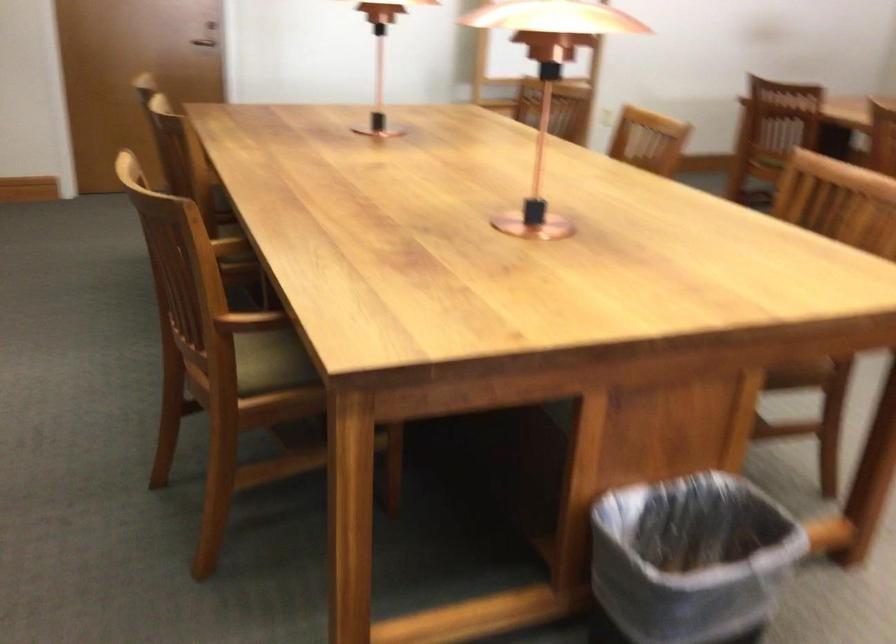
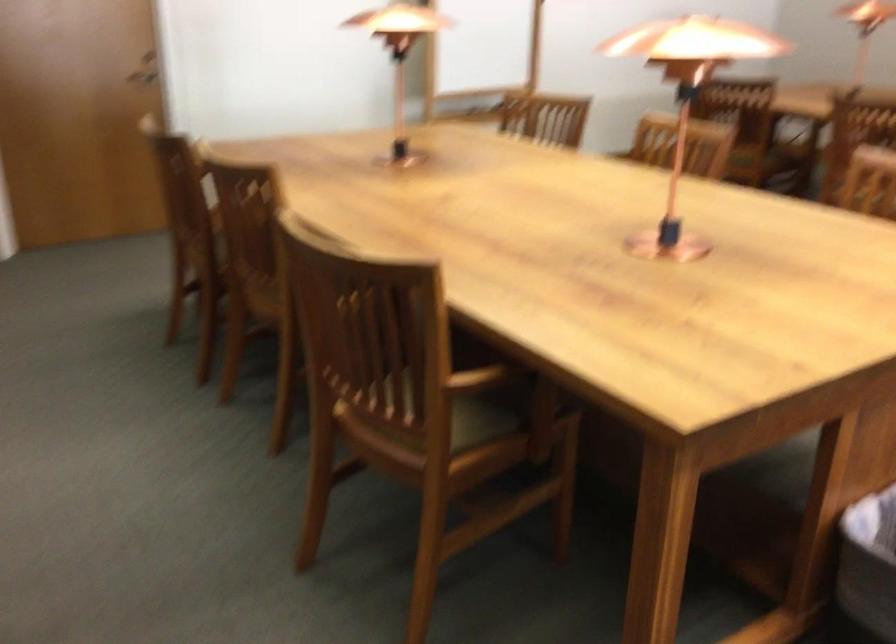
Question: Based on the continuous images, in which direction is the camera rotating? Reply with the corresponding letter.

Choices:
 (A) Left
 (B) Right
 (C) Up
 (D) Down

Answer: (B)